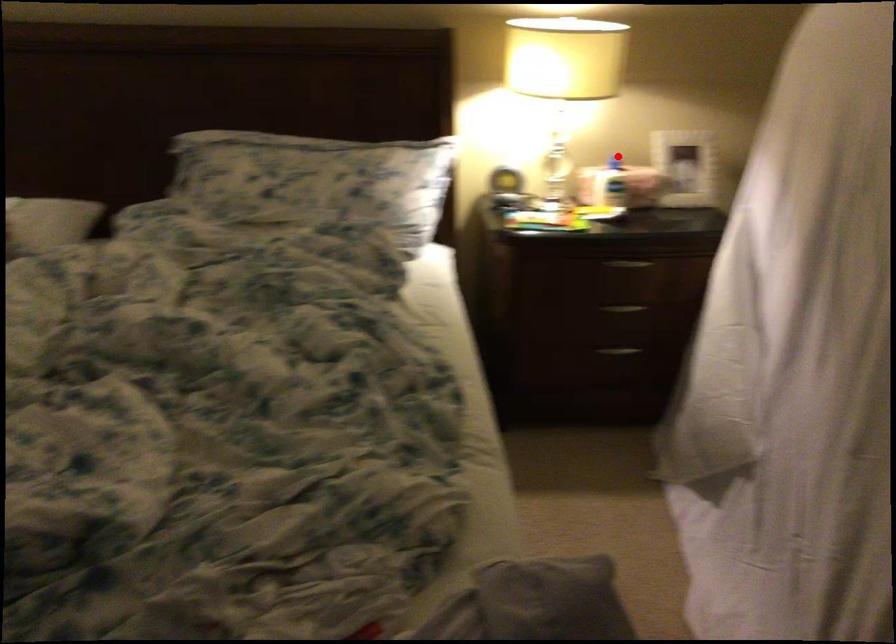
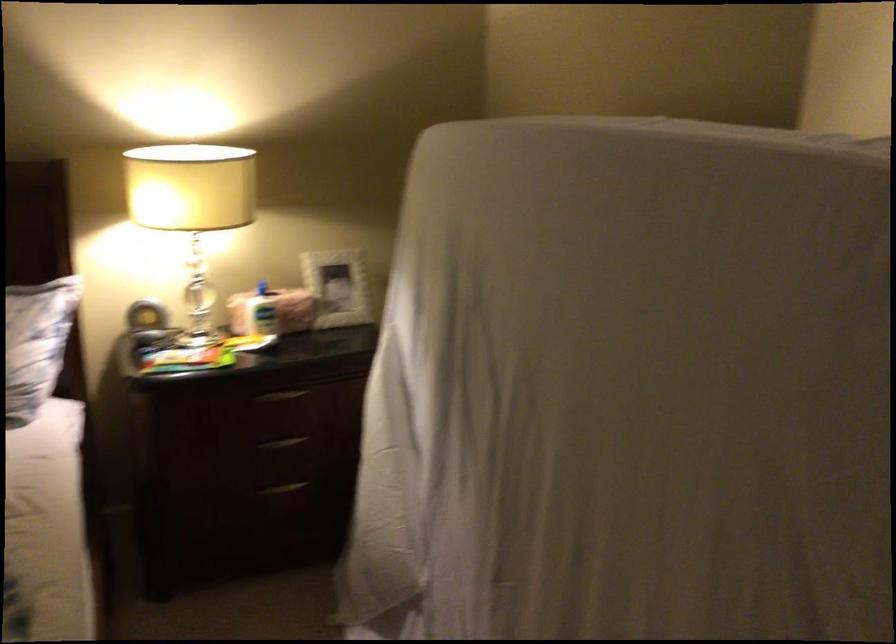
Locate, in the second image, the point that corresponds to the highlighted location in the first image.

(262, 288)